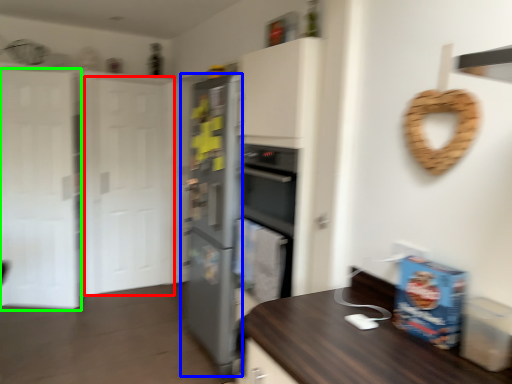
Question: Considering the real-world distances, which object is closest to glass door (highlighted by a red box)? refrigerator (highlighted by a blue box) or glass door (highlighted by a green box).

Choices:
 (A) refrigerator
 (B) glass door

Answer: (B)